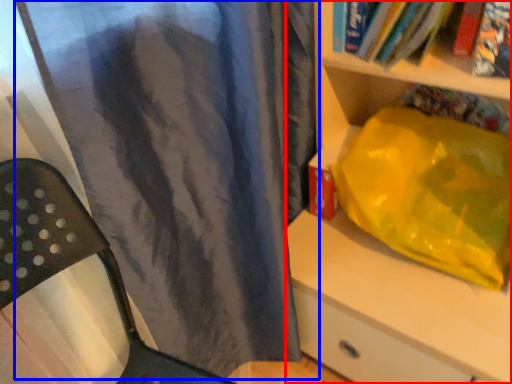
Question: Which object appears closest to the camera in this image, shelf (highlighted by a red box) or curtain (highlighted by a blue box)?

Choices:
 (A) shelf
 (B) curtain

Answer: (B)